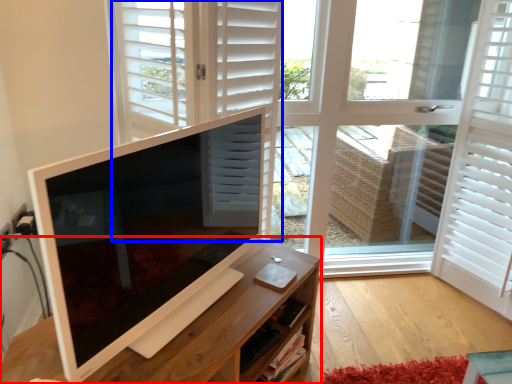
Question: Which of the following is the farthest to the observer, desk (highlighted by a red box) or door (highlighted by a blue box)?

Choices:
 (A) desk
 (B) door

Answer: (B)